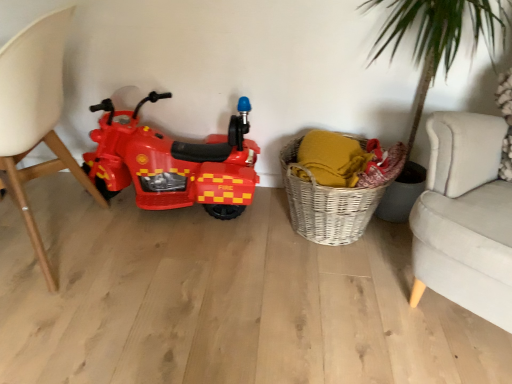
This screenshot has width=512, height=384. In order to click on vacant space that is in between matte white chair at left and woven wicker basket at lower right in this screenshot , I will do `click(211, 251)`.